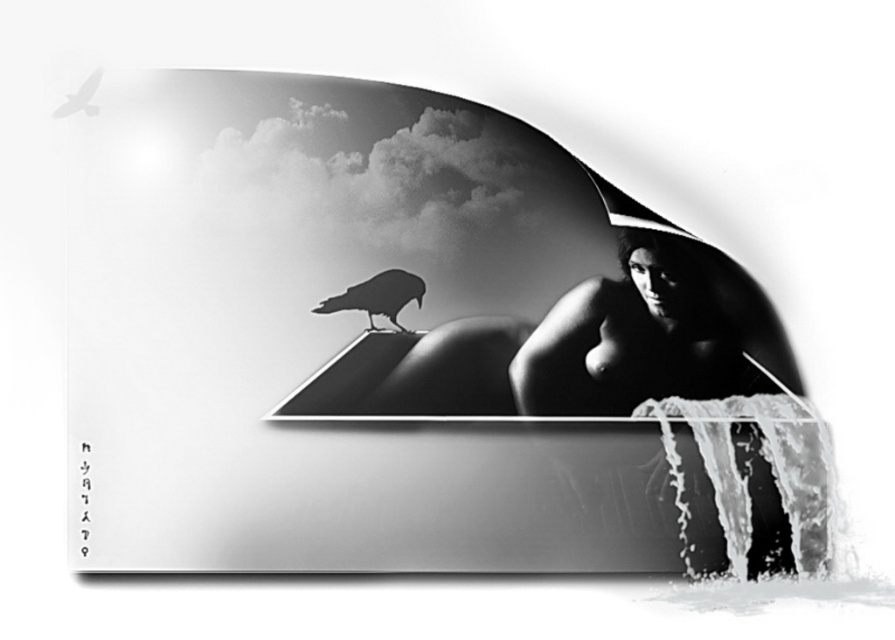
Question: Is smooth skin woman at center smaller than black matte bird at center?

Choices:
 (A) no
 (B) yes

Answer: (A)

Question: Considering the relative positions of black matte bird at center and black matte crow at upper left in the image provided, where is black matte bird at center located with respect to black matte crow at upper left?

Choices:
 (A) left
 (B) right

Answer: (B)

Question: Which of the following is the closest to the observer?

Choices:
 (A) black matte crow at upper left
 (B) black matte bird at center
 (C) smooth skin woman at center

Answer: (A)

Question: Considering the real-world distances, which object is farthest from the smooth skin woman at center?

Choices:
 (A) black matte crow at upper left
 (B) black matte bird at center

Answer: (A)

Question: Does smooth skin woman at center appear over black matte bird at center?

Choices:
 (A) yes
 (B) no

Answer: (B)

Question: Which of the following is the farthest from the observer?

Choices:
 (A) black matte bird at center
 (B) smooth skin woman at center

Answer: (A)